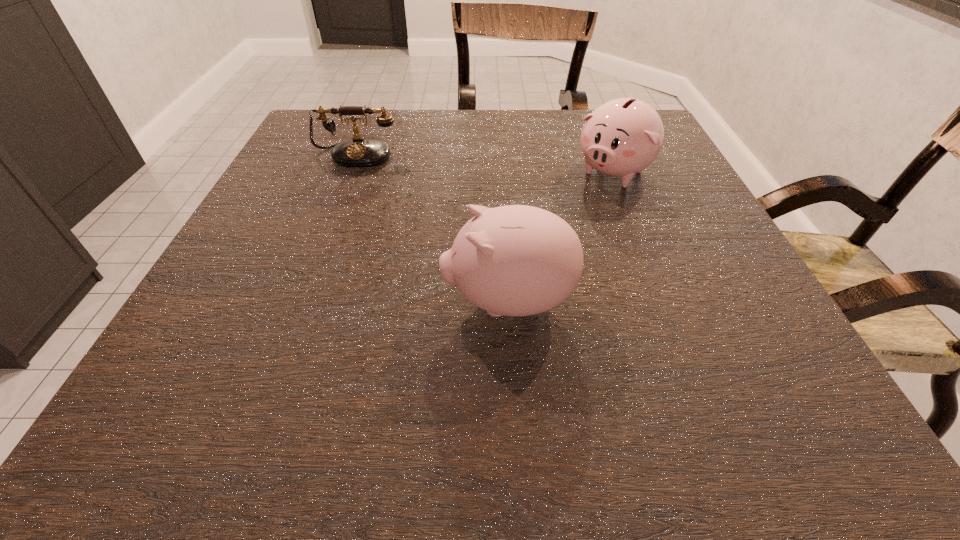
Where is `the left piggy bank`? the left piggy bank is located at coordinates (516, 260).

Find the location of a particular element. The height and width of the screenshot is (540, 960). the nearer piggy bank is located at coordinates (516, 260).

At what (x,y) coordinates should I click in order to perform the action: click on the farther piggy bank. Please return your answer as a coordinate pair (x, y). Looking at the image, I should click on (622, 137).

Locate an element on the screen. The image size is (960, 540). the right piggy bank is located at coordinates (622, 137).

At what (x,y) coordinates should I click in order to perform the action: click on the leftmost object. Please return your answer as a coordinate pair (x, y). This screenshot has height=540, width=960. Looking at the image, I should click on (359, 152).

At what (x,y) coordinates should I click in order to perform the action: click on the shortest object. Please return your answer as a coordinate pair (x, y). This screenshot has width=960, height=540. Looking at the image, I should click on (359, 152).

Identify the location of vacant space located at the snout of the nearer piggy bank. This screenshot has width=960, height=540. (393, 301).

Where is `free space located 0.250m at the snout of the nearer piggy bank`? free space located 0.250m at the snout of the nearer piggy bank is located at coordinates (285, 301).

You are a GUI agent. You are given a task and a screenshot of the screen. Output one action in this format:
    pyautogui.click(x=<x>, y=<y>)
    Task: Click on the free space located at the snout of the nearer piggy bank
    The image size is (960, 540).
    Given the screenshot: What is the action you would take?
    pyautogui.click(x=279, y=301)

In order to click on free space located on the front of the right piggy bank in this screenshot , I will do `click(662, 297)`.